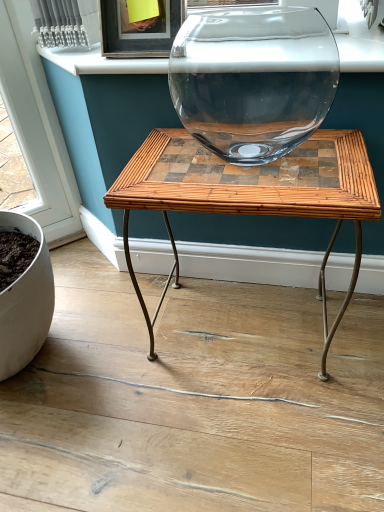
Question: Considering the relative sizes of bamboo/rattan table at center and white glossy window sill at upper center in the image provided, is bamboo/rattan table at center taller than white glossy window sill at upper center?

Choices:
 (A) yes
 (B) no

Answer: (A)

Question: From the image's perspective, is bamboo/rattan table at center above white glossy window sill at upper center?

Choices:
 (A) yes
 (B) no

Answer: (B)

Question: Is bamboo/rattan table at center oriented away from white glossy window sill at upper center?

Choices:
 (A) yes
 (B) no

Answer: (B)

Question: From a real-world perspective, is bamboo/rattan table at center located beneath white glossy window sill at upper center?

Choices:
 (A) no
 (B) yes

Answer: (B)

Question: Does bamboo/rattan table at center have a greater width compared to white glossy window sill at upper center?

Choices:
 (A) yes
 (B) no

Answer: (A)

Question: Is bamboo/rattan table at center next to white glossy window sill at upper center?

Choices:
 (A) no
 (B) yes

Answer: (A)

Question: Is the depth of white glossy window sill at upper center less than that of bamboo/rattan table at center?

Choices:
 (A) yes
 (B) no

Answer: (B)

Question: Is white glossy window sill at upper center not within bamboo/rattan table at center?

Choices:
 (A) no
 (B) yes

Answer: (B)

Question: From a real-world perspective, is white glossy window sill at upper center on bamboo/rattan table at center?

Choices:
 (A) no
 (B) yes

Answer: (B)

Question: Can you confirm if white glossy window sill at upper center is wider than bamboo/rattan table at center?

Choices:
 (A) no
 (B) yes

Answer: (A)

Question: From the image's perspective, is white glossy window sill at upper center below bamboo/rattan table at center?

Choices:
 (A) no
 (B) yes

Answer: (A)

Question: Is white glossy window sill at upper center taller than bamboo/rattan table at center?

Choices:
 (A) yes
 (B) no

Answer: (B)

Question: Does point (352, 37) appear closer or farther from the camera than point (314, 183)?

Choices:
 (A) farther
 (B) closer

Answer: (A)